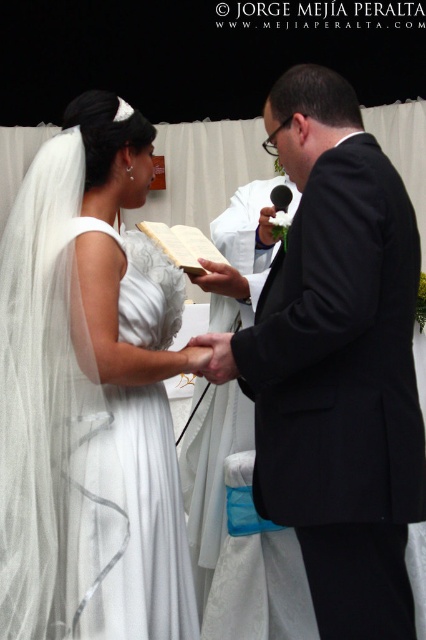
Question: Is white satin dress at center wider than white paper book at center?

Choices:
 (A) no
 (B) yes

Answer: (B)

Question: In this image, where is white satin dress at center located relative to white paper book at center?

Choices:
 (A) below
 (B) above

Answer: (A)

Question: Which point is farther to the camera?

Choices:
 (A) white satin dress at center
 (B) white paper book at center

Answer: (B)

Question: Can you confirm if white satin dress at center is wider than white paper book at center?

Choices:
 (A) yes
 (B) no

Answer: (A)